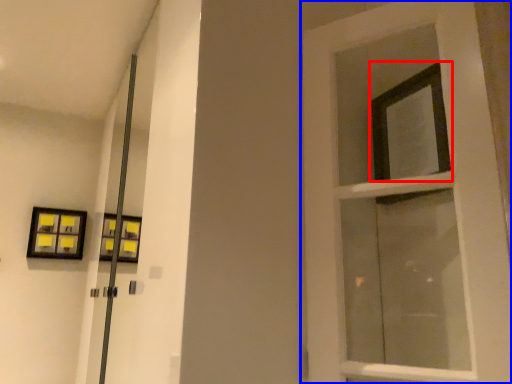
Question: Among these objects, which one is farthest to the camera, window (highlighted by a red box) or door (highlighted by a blue box)?

Choices:
 (A) window
 (B) door

Answer: (A)